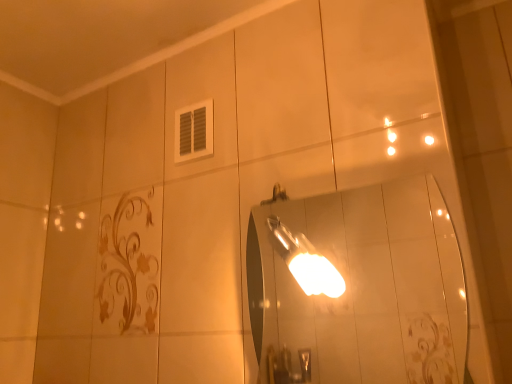
This screenshot has width=512, height=384. Find the location of `glossy silver mirror at center`. glossy silver mirror at center is located at coordinates (360, 288).

What do you see at coordinates (360, 288) in the screenshot? The height and width of the screenshot is (384, 512). I see `glossy silver mirror at center` at bounding box center [360, 288].

This screenshot has width=512, height=384. What do you see at coordinates (305, 261) in the screenshot?
I see `metallic silver light fixture at center` at bounding box center [305, 261].

Locate an element on the screen. The height and width of the screenshot is (384, 512). metallic silver light fixture at center is located at coordinates (305, 261).

Identify the location of glossy silver mirror at center. (360, 288).

Considering the relative positions of metallic silver light fixture at center and glossy silver mirror at center in the image provided, is metallic silver light fixture at center to the left or to the right of glossy silver mirror at center?

From the image, it's evident that metallic silver light fixture at center is to the left of glossy silver mirror at center.

Between metallic silver light fixture at center and glossy silver mirror at center, which one is positioned behind?

Positioned behind is metallic silver light fixture at center.

Is point (302, 245) more distant than point (430, 264)?

Yes.

From the image's perspective, who appears lower, metallic silver light fixture at center or glossy silver mirror at center?

glossy silver mirror at center.

From a real-world perspective, is metallic silver light fixture at center positioned under glossy silver mirror at center based on gravity?

No, from a real-world perspective, metallic silver light fixture at center is not beneath glossy silver mirror at center.

Does metallic silver light fixture at center have a greater width compared to glossy silver mirror at center?

Yes.

Which of these two, metallic silver light fixture at center or glossy silver mirror at center, stands shorter?

metallic silver light fixture at center.

Is metallic silver light fixture at center bigger than glossy silver mirror at center?

No, metallic silver light fixture at center is not bigger than glossy silver mirror at center.

Is metallic silver light fixture at center inside or outside of glossy silver mirror at center?

metallic silver light fixture at center cannot be found inside glossy silver mirror at center.

Is metallic silver light fixture at center in contact with glossy silver mirror at center?

No, metallic silver light fixture at center is not beside glossy silver mirror at center.

Could you tell me if metallic silver light fixture at center is turned towards glossy silver mirror at center?

No, metallic silver light fixture at center does not turn towards glossy silver mirror at center.

The height and width of the screenshot is (384, 512). In order to click on light fixture above the glossy silver mirror at center (from the image's perspective) in this screenshot , I will do `click(305, 261)`.

In the image, is glossy silver mirror at center on the left side or the right side of metallic silver light fixture at center?

In the image, glossy silver mirror at center appears on the right side of metallic silver light fixture at center.

Which object is more forward, glossy silver mirror at center or metallic silver light fixture at center?

glossy silver mirror at center is more forward.

Which is behind, point (353, 266) or point (297, 281)?

Positioned behind is point (353, 266).

From the image's perspective, is glossy silver mirror at center under metallic silver light fixture at center?

Indeed, from the image's perspective, glossy silver mirror at center is shown beneath metallic silver light fixture at center.

From a real-world perspective, which object rests below the other?

glossy silver mirror at center is physically lower.

Which of these two, glossy silver mirror at center or metallic silver light fixture at center, is thinner?

Thinner between the two is glossy silver mirror at center.

From the picture: Between glossy silver mirror at center and metallic silver light fixture at center, which one has more height?

Standing taller between the two is glossy silver mirror at center.

Which of these two, glossy silver mirror at center or metallic silver light fixture at center, is bigger?

glossy silver mirror at center is bigger.

Is metallic silver light fixture at center completely or partially inside glossy silver mirror at center?

No.

Is glossy silver mirror at center directly adjacent to metallic silver light fixture at center?

They are not placed beside each other.

Is glossy silver mirror at center turned away from metallic silver light fixture at center?

Yes, glossy silver mirror at center is positioned with its back facing metallic silver light fixture at center.

How different are the orientations of glossy silver mirror at center and metallic silver light fixture at center in degrees?

glossy silver mirror at center and metallic silver light fixture at center are facing 0.00625 degrees away from each other.

Where is `mirror in front of the metallic silver light fixture at center`? The height and width of the screenshot is (384, 512). mirror in front of the metallic silver light fixture at center is located at coordinates (360, 288).

Identify the location of light fixture that appears behind the glossy silver mirror at center. The width and height of the screenshot is (512, 384). (305, 261).

Locate an element on the screen. mirror that appears below the metallic silver light fixture at center (from the image's perspective) is located at coordinates (360, 288).